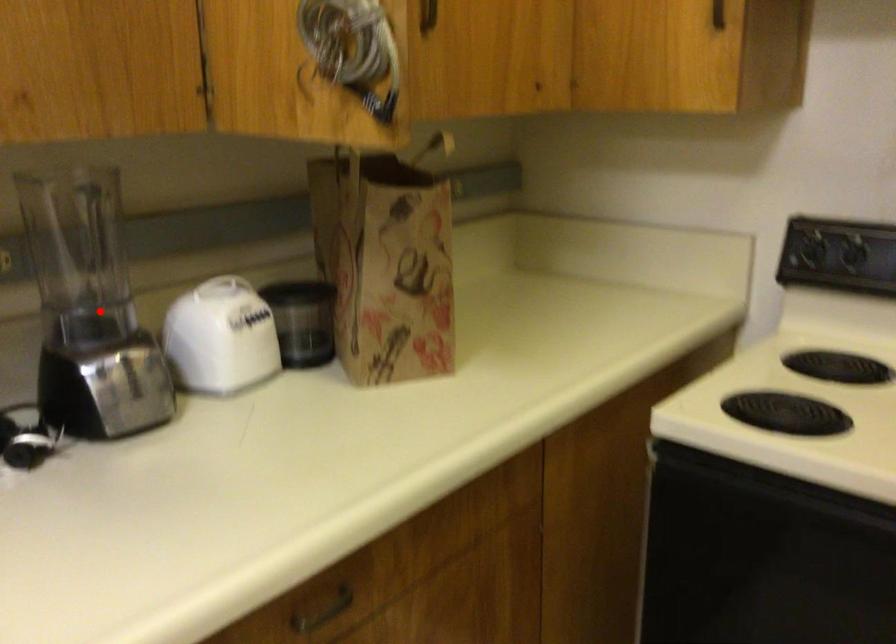
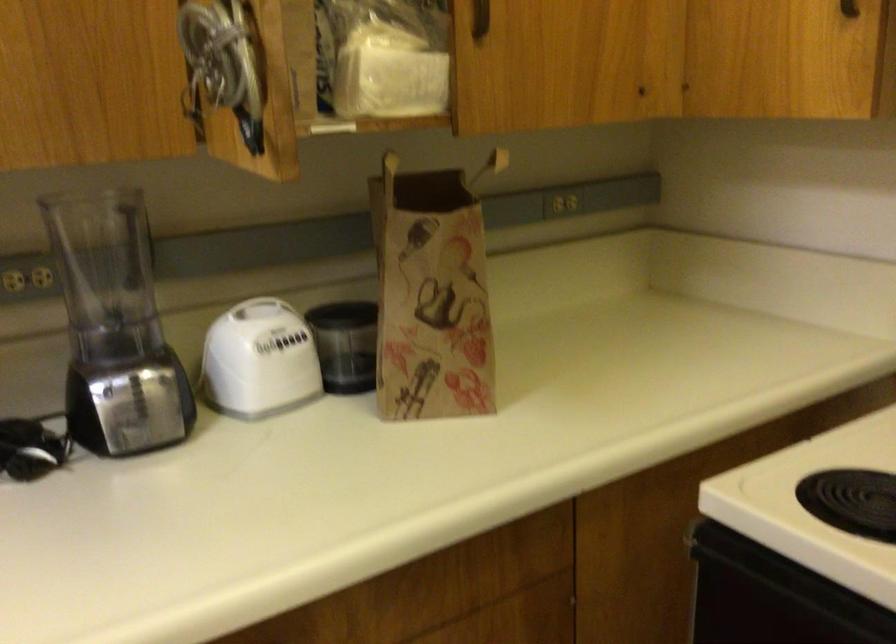
In the second image, find the point that corresponds to the highlighted location in the first image.

(115, 327)